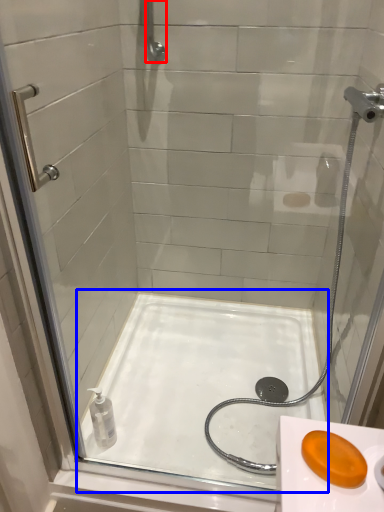
Question: Among these objects, which one is farthest to the camera, shower (highlighted by a red box) or bath (highlighted by a blue box)?

Choices:
 (A) shower
 (B) bath

Answer: (A)